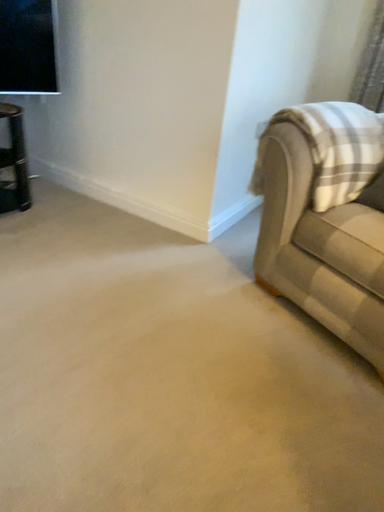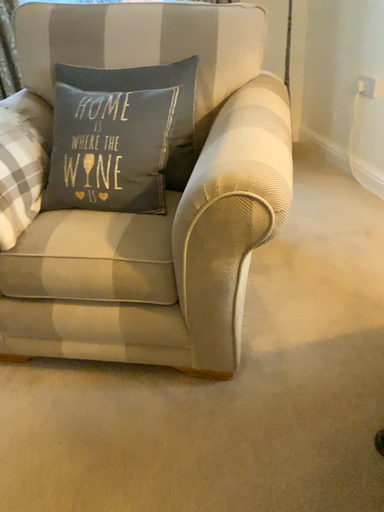
Question: How did the camera likely rotate when shooting the video?

Choices:
 (A) rotated right
 (B) rotated left

Answer: (A)